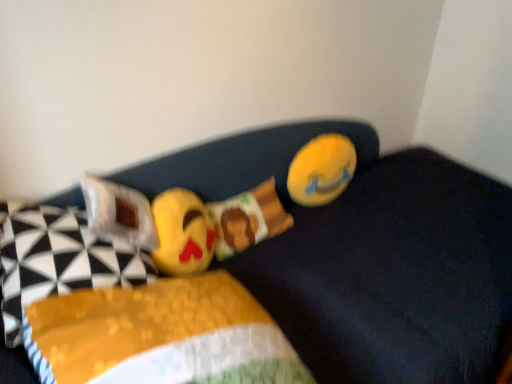
Question: Does soft plush emoji at center, which ranks as the 1th toy in left-to-right order, have a greater width compared to yellow fabric pillow at left, marked as the 1th pillow in a left-to-right arrangement?

Choices:
 (A) no
 (B) yes

Answer: (A)

Question: From the image's perspective, is soft plush emoji at center, the second toy positioned from the back, located beneath yellow fabric pillow at left, marked as the 1th pillow in a left-to-right arrangement?

Choices:
 (A) no
 (B) yes

Answer: (A)

Question: From a real-world perspective, is soft plush emoji at center, which is the 2th toy in right-to-left order, physically above yellow fabric pillow at left, which is counted as the 2th pillow, starting from the right?

Choices:
 (A) yes
 (B) no

Answer: (B)

Question: From the image's perspective, is soft plush emoji at center, which is the 2th toy in right-to-left order, on yellow fabric pillow at left, marked as the 1th pillow in a left-to-right arrangement?

Choices:
 (A) yes
 (B) no

Answer: (A)

Question: Are soft plush emoji at center, which ranks as the 1th toy in left-to-right order, and yellow fabric pillow at left, marked as the 1th pillow in a left-to-right arrangement, making contact?

Choices:
 (A) no
 (B) yes

Answer: (A)

Question: From a real-world perspective, is soft plush emoji at center, which is the 2th toy in right-to-left order, positioned above or below white fabric pillow at left, which is counted as the 2th pillow, starting from the left?

Choices:
 (A) above
 (B) below

Answer: (B)

Question: Is point (177, 271) closer or farther from the camera than point (138, 244)?

Choices:
 (A) farther
 (B) closer

Answer: (A)

Question: In terms of size, does soft plush emoji at center, positioned as the 1th toy in front-to-back order, appear bigger or smaller than white fabric pillow at left, which is counted as the 2th pillow, starting from the left?

Choices:
 (A) big
 (B) small

Answer: (A)

Question: From the image's perspective, is soft plush emoji at center, the second toy positioned from the back, positioned above or below white fabric pillow at left, which is counted as the 2th pillow, starting from the left?

Choices:
 (A) below
 (B) above

Answer: (A)

Question: Considering the positions of soft plush emoji at center, the second toy positioned from the back, and yellow plush toy at upper right, acting as the 2th toy starting from the front, in the image, is soft plush emoji at center, the second toy positioned from the back, taller or shorter than yellow plush toy at upper right, acting as the 2th toy starting from the front,?

Choices:
 (A) tall
 (B) short

Answer: (B)

Question: In terms of size, does soft plush emoji at center, which is the 2th toy in right-to-left order, appear bigger or smaller than yellow plush toy at upper right, the 1th toy viewed from the back?

Choices:
 (A) big
 (B) small

Answer: (A)

Question: Considering their positions, is soft plush emoji at center, which is the 2th toy in right-to-left order, located in front of or behind yellow plush toy at upper right, the 1th toy viewed from the back?

Choices:
 (A) behind
 (B) front

Answer: (B)

Question: Is point (154, 258) positioned closer to the camera than point (314, 196)?

Choices:
 (A) closer
 (B) farther

Answer: (A)

Question: From the image's perspective, relative to yellow plush toy at upper right, which is the 2th toy in left-to-right order, is white fabric pillow at left, marked as the 1th pillow in a right-to-left arrangement, above or below?

Choices:
 (A) below
 (B) above

Answer: (A)

Question: Is white fabric pillow at left, which is counted as the 2th pillow, starting from the left, bigger or smaller than yellow plush toy at upper right, the first toy viewed from the right?

Choices:
 (A) big
 (B) small

Answer: (A)